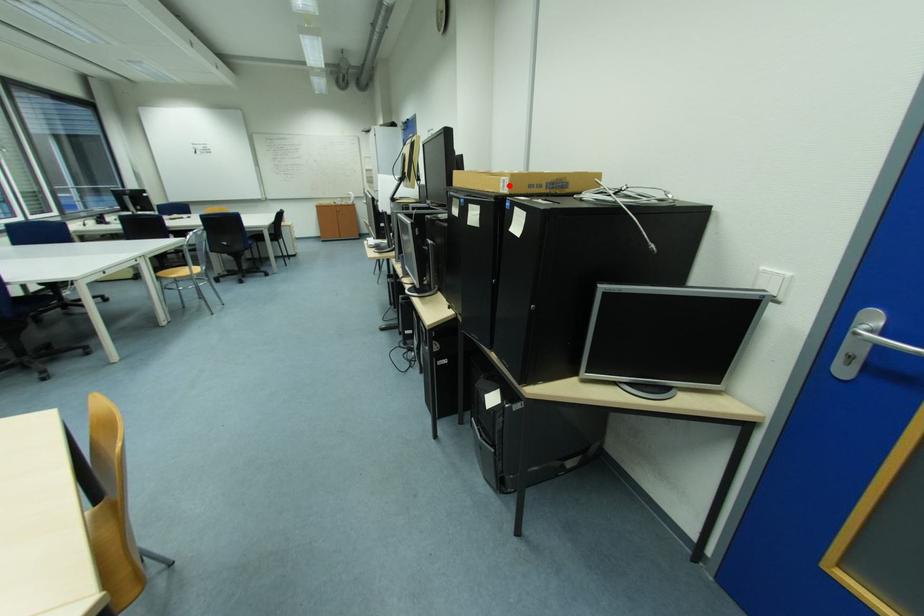
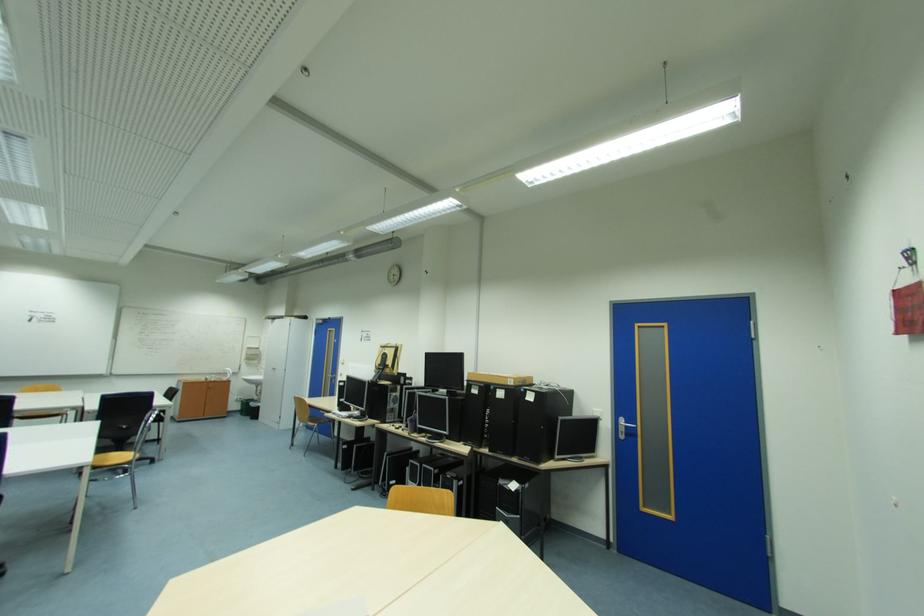
Locate, in the second image, the point that corresponds to the highlighted location in the first image.

(517, 382)